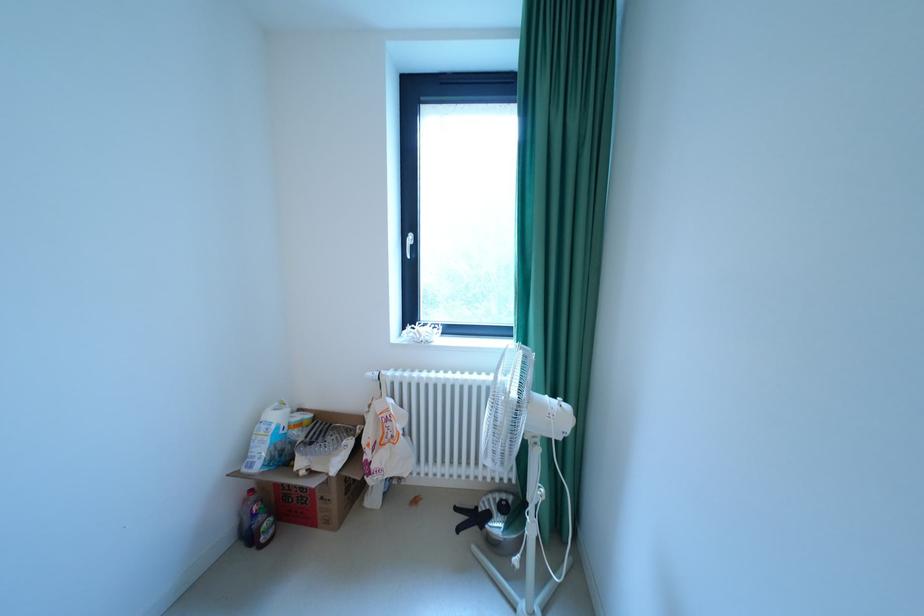
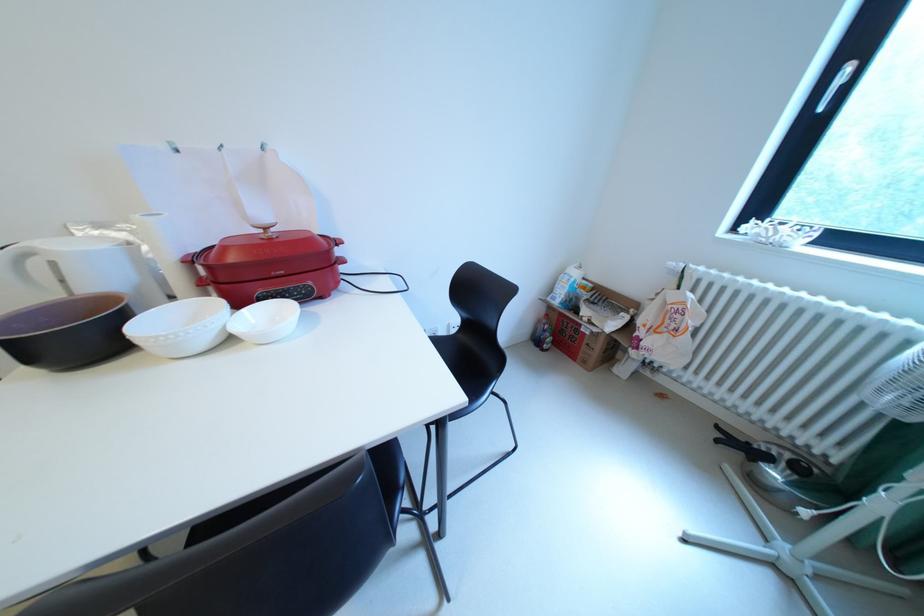
The images are taken continuously from a first-person perspective. In which direction is your viewpoint rotating?

The camera rotated toward left-down.